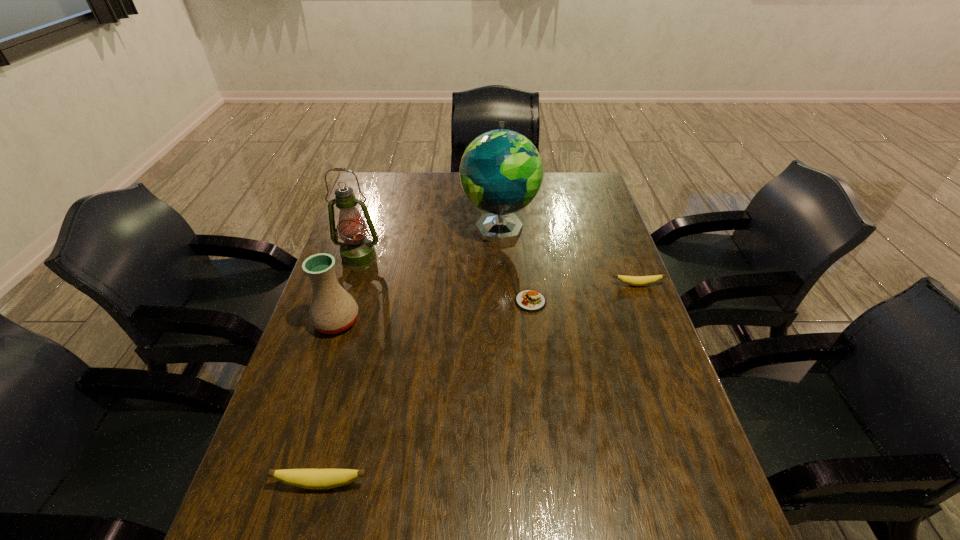
Image resolution: width=960 pixels, height=540 pixels. What are the coordinates of `free space that is in between the shortest object and the pottery` in the screenshot? It's located at (434, 312).

Find the location of a particular element. free spot between the third tallest object and the patty (food) is located at coordinates click(434, 312).

The image size is (960, 540). I want to click on unoccupied position between the fifth tallest object and the patty (food), so click(x=584, y=293).

At what (x,y) coordinates should I click in order to perform the action: click on free space between the oil lamp and the patty (food). Please return your answer as a coordinate pair (x, y). The height and width of the screenshot is (540, 960). Looking at the image, I should click on (444, 280).

Find the location of a particular element. This screenshot has width=960, height=540. object that stands as the fourth closest to the fifth tallest object is located at coordinates (332, 310).

Select which object appears as the third closest to the oil lamp. Please provide its 2D coordinates. Your answer should be formatted as a tuple, i.e. [(x, y)], where the tuple contains the x and y coordinates of a point satisfying the conditions above.

[(529, 300)]

Locate an element on the screen. The height and width of the screenshot is (540, 960). vacant space that satisfies the following two spatial constraints: 1. on the front surface of the rightmost object; 2. on the right side of the globe is located at coordinates (502, 285).